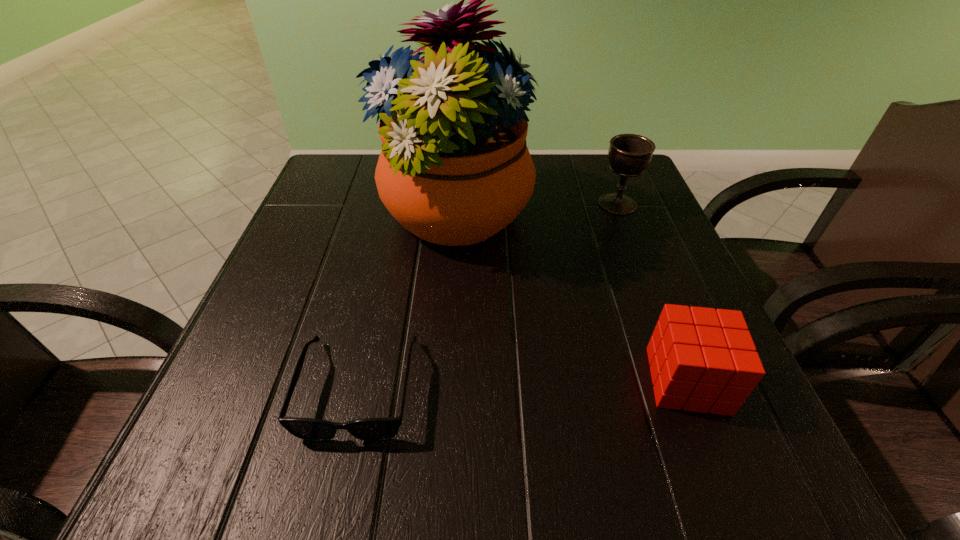
In order to click on free space at the far left corner in this screenshot , I will do `click(323, 180)`.

You are a GUI agent. You are given a task and a screenshot of the screen. Output one action in this format:
    pyautogui.click(x=<x>, y=<y>)
    Task: Click on the blank space at the near left corner of the desktop
    
    Given the screenshot: What is the action you would take?
    click(229, 476)

I want to click on vacant space at the far right corner of the desktop, so click(628, 193).

The width and height of the screenshot is (960, 540). I want to click on vacant area that lies between the tallest object and the sunglasses, so click(407, 303).

The height and width of the screenshot is (540, 960). In order to click on free space that is in between the chalice and the sunglasses in this screenshot , I will do `click(488, 296)`.

Identify the location of free area in between the sunglasses and the second shortest object. (523, 384).

Identify the location of blank region between the flower arrangement and the chalice. The width and height of the screenshot is (960, 540). (536, 211).

This screenshot has width=960, height=540. Identify the location of empty space that is in between the second shortest object and the chalice. (652, 292).

This screenshot has width=960, height=540. I want to click on vacant region between the tallest object and the third tallest object, so click(x=571, y=299).

Locate an element on the screen. free spot between the tallest object and the shortest object is located at coordinates (407, 303).